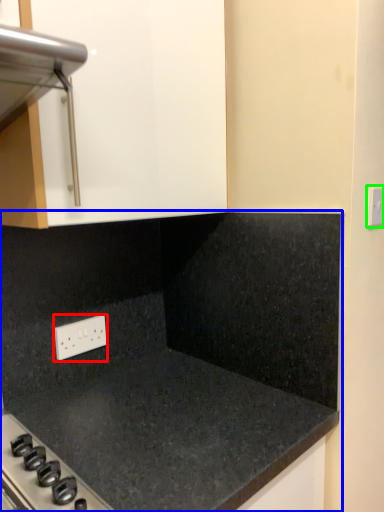
Question: Estimate the real-world distances between objects in this image. Which object is closer to electric outlet (highlighted by a red box), countertop (highlighted by a blue box) or electric outlet (highlighted by a green box)?

Choices:
 (A) countertop
 (B) electric outlet

Answer: (A)